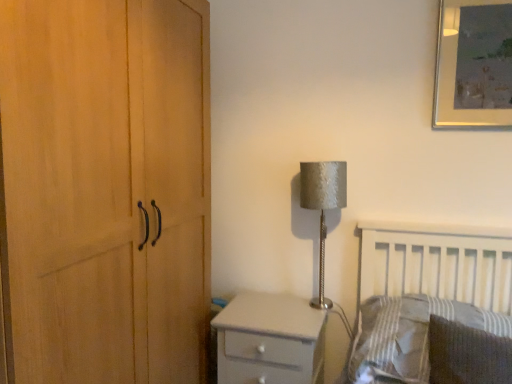
Question: Considering the relative sizes of white glossy chest of drawers at lower center and striped fabric pillow at lower right, the second pillow in the front-to-back sequence, in the image provided, is white glossy chest of drawers at lower center smaller than striped fabric pillow at lower right, the second pillow in the front-to-back sequence,?

Choices:
 (A) yes
 (B) no

Answer: (B)

Question: Does white glossy chest of drawers at lower center have a lesser width compared to striped fabric pillow at lower right, the second pillow in the front-to-back sequence?

Choices:
 (A) no
 (B) yes

Answer: (A)

Question: Considering the relative positions of white glossy chest of drawers at lower center and striped fabric pillow at lower right, the second pillow in the front-to-back sequence, in the image provided, is white glossy chest of drawers at lower center in front of striped fabric pillow at lower right, the second pillow in the front-to-back sequence,?

Choices:
 (A) yes
 (B) no

Answer: (B)

Question: Is the position of white glossy chest of drawers at lower center more distant than that of striped fabric pillow at lower right, the second pillow in the front-to-back sequence?

Choices:
 (A) no
 (B) yes

Answer: (B)

Question: Is white glossy chest of drawers at lower center to the right of striped fabric pillow at lower right, the first pillow viewed from the back, from the viewer's perspective?

Choices:
 (A) no
 (B) yes

Answer: (A)

Question: Is white glossy chest of drawers at lower center wider than striped fabric pillow at lower right, the second pillow in the front-to-back sequence?

Choices:
 (A) yes
 (B) no

Answer: (A)

Question: Can you confirm if white glossy chest of drawers at lower center is bigger than silver textured lampshade at upper right?

Choices:
 (A) yes
 (B) no

Answer: (A)

Question: From the image's perspective, is white glossy chest of drawers at lower center on silver textured lampshade at upper right?

Choices:
 (A) no
 (B) yes

Answer: (A)

Question: Does white glossy chest of drawers at lower center have a lesser width compared to silver textured lampshade at upper right?

Choices:
 (A) no
 (B) yes

Answer: (A)

Question: Is white glossy chest of drawers at lower center outside silver textured lampshade at upper right?

Choices:
 (A) no
 (B) yes

Answer: (B)

Question: Does white glossy chest of drawers at lower center have a greater width compared to silver textured lampshade at upper right?

Choices:
 (A) yes
 (B) no

Answer: (A)

Question: Is white glossy chest of drawers at lower center smaller than silver textured lampshade at upper right?

Choices:
 (A) no
 (B) yes

Answer: (A)

Question: Is white glossy chest of drawers at lower center further to the viewer compared to dark gray textured pillow at lower right, the 1th pillow in the front-to-back sequence?

Choices:
 (A) yes
 (B) no

Answer: (A)